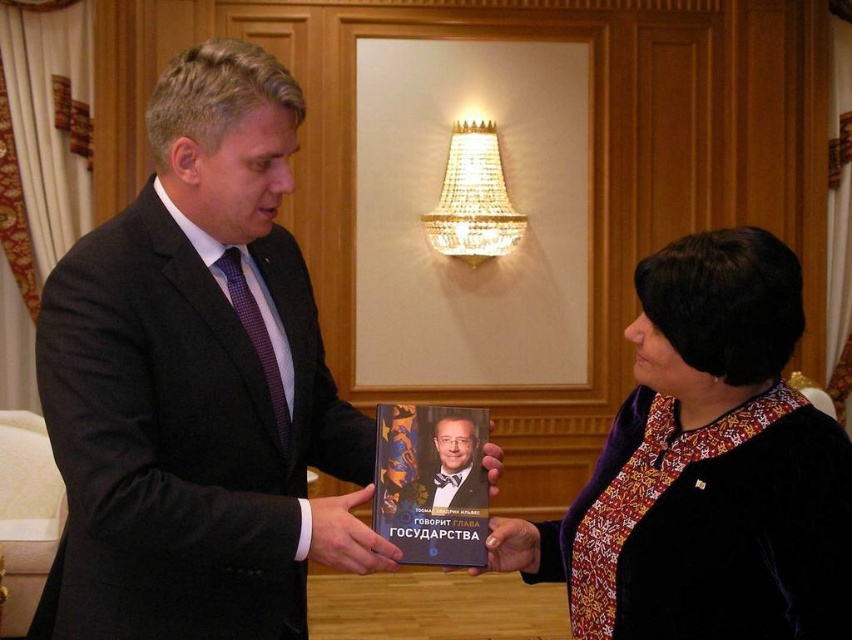
Based on the photo, does smooth black hand at center have a greater height compared to matte black book at center?

Correct, smooth black hand at center is much taller as matte black book at center.

From the picture: Between smooth black hand at center and matte black book at center, which one is positioned lower?

matte black book at center is below.

Who is more distant from viewer, (350, 566) or (509, 531)?

The point (509, 531) is behind.

The image size is (852, 640). In order to click on smooth black hand at center in this screenshot , I will do `click(347, 536)`.

Is dark gray wool suit at left wider than velvet black dress at center?

Indeed, dark gray wool suit at left has a greater width compared to velvet black dress at center.

Can you confirm if dark gray wool suit at left is thinner than velvet black dress at center?

No.

At what (x,y) coordinates should I click in order to perform the action: click on dark gray wool suit at left. Please return your answer as a coordinate pair (x, y). The width and height of the screenshot is (852, 640). Looking at the image, I should click on (183, 433).

Is velvet black dress at center further to the viewer compared to matte black book at center?

No, it is in front of matte black book at center.

Is velvet black dress at center positioned in front of matte black book at center?

Yes, velvet black dress at center is in front of matte black book at center.

Where is `velvet black dress at center`? This screenshot has height=640, width=852. velvet black dress at center is located at coordinates (711, 467).

This screenshot has height=640, width=852. I want to click on velvet black dress at center, so click(711, 467).